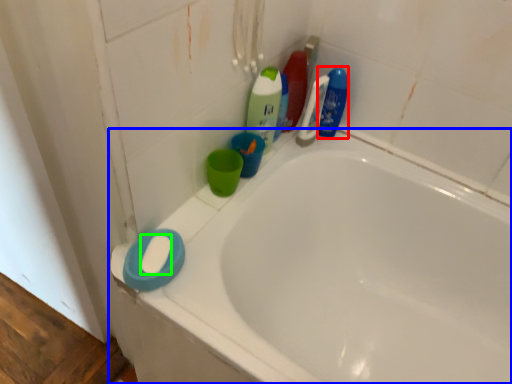
Question: Which is nearer to the cleaning product (highlighted by a red box)? bathtub (highlighted by a blue box) or soap (highlighted by a green box).

Choices:
 (A) bathtub
 (B) soap

Answer: (A)